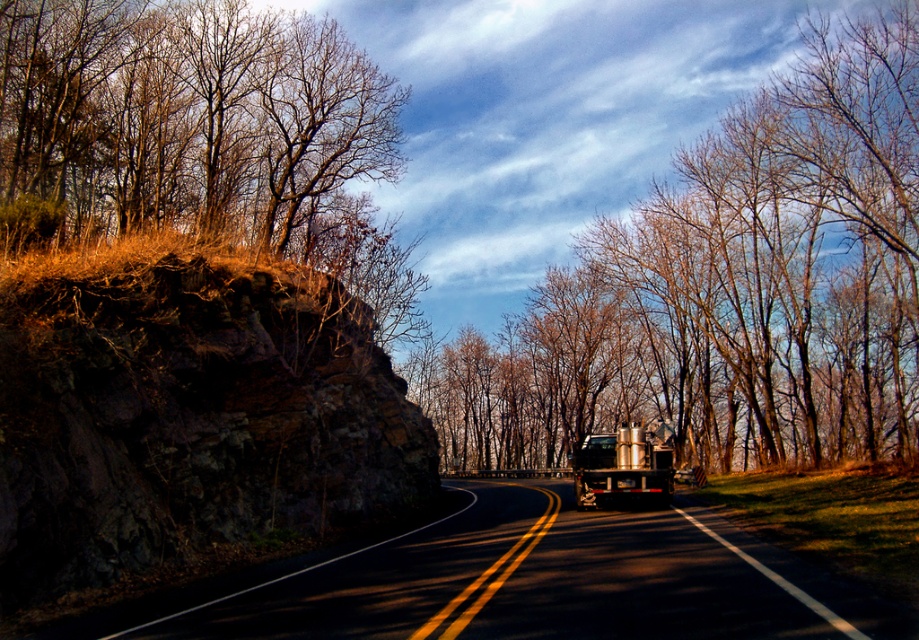
Is rocky cliff at left to the left of metallic silver trailer truck at center-right from the viewer's perspective?

Correct, you'll find rocky cliff at left to the left of metallic silver trailer truck at center-right.

Does rocky cliff at left have a lesser height compared to metallic silver trailer truck at center-right?

No.

Who is more forward, (180,259) or (664,456)?

Point (180,259) is more forward.

Locate an element on the screen. The image size is (919, 640). rocky cliff at left is located at coordinates (186, 412).

Which is more to the left, bare branches at center or metallic silver trailer truck at center-right?

metallic silver trailer truck at center-right is more to the left.

Which is above, bare branches at center or metallic silver trailer truck at center-right?

Positioned higher is bare branches at center.

Image resolution: width=919 pixels, height=640 pixels. What are the coordinates of `bare branches at center` in the screenshot? It's located at (728, 289).

Between point (741, 332) and point (528, 502), which one is positioned behind?

Point (741, 332)

The width and height of the screenshot is (919, 640). In order to click on bare branches at center in this screenshot , I will do `click(728, 289)`.

At what (x,y) coordinates should I click in order to perform the action: click on bare branches at center. Please return your answer as a coordinate pair (x, y). Looking at the image, I should click on (728, 289).